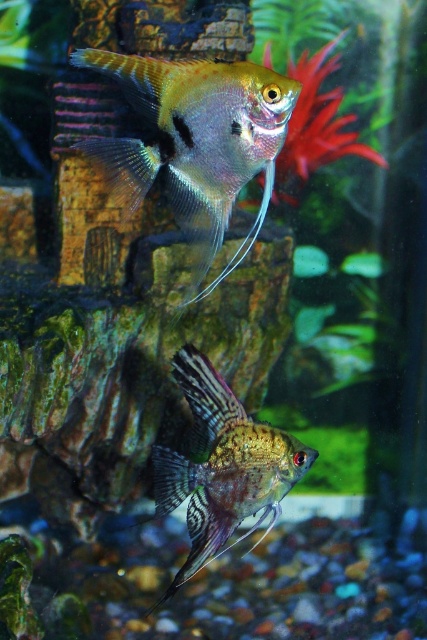
You are an aquarium maintenance worker. You need to identify which fish is larger between the translucent iridescent fish at upper center and the shiny metallic fish at center. Which one is bigger?

The translucent iridescent fish at upper center is bigger than the shiny metallic fish at center.

You are an underwater photographer aiming to capture both the translucent iridescent fish at upper center and the shiny metallic fish at center in a single frame. Based on their positions, which fish will appear closer to the camera lens?

The translucent iridescent fish at upper center will appear closer to the camera lens because it is positioned higher in the frame than the shiny metallic fish at center.